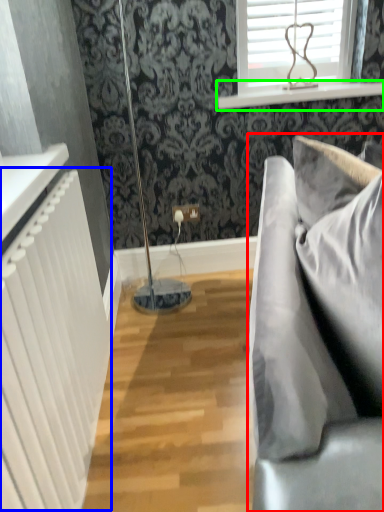
Question: Which is farther away from studio couch (highlighted by a red box)? radiator (highlighted by a blue box) or window sill (highlighted by a green box)?

Choices:
 (A) radiator
 (B) window sill

Answer: (B)